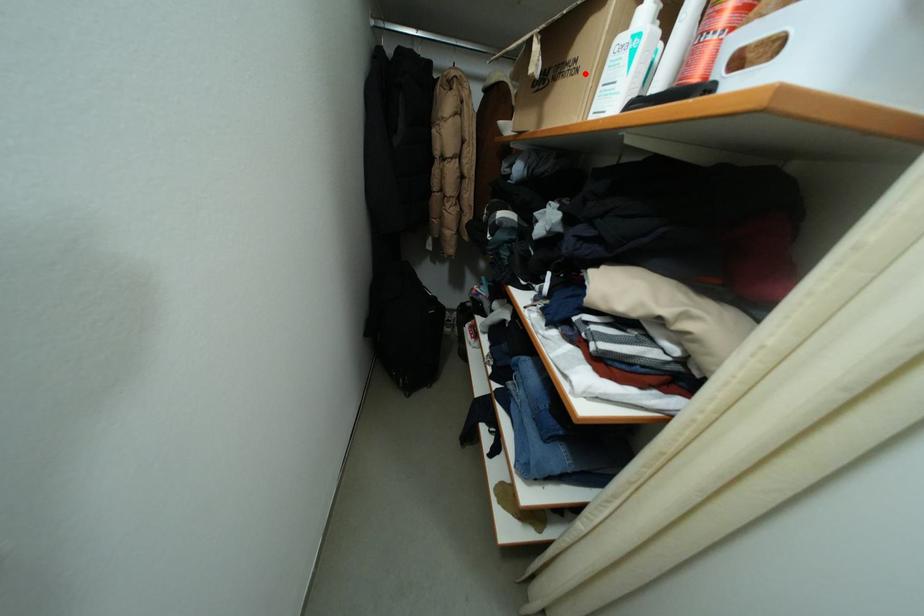
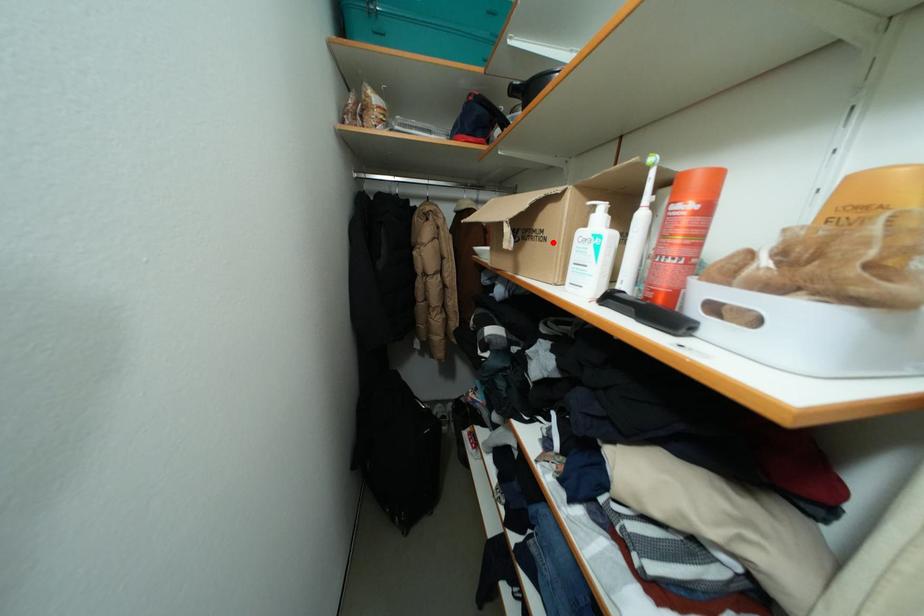
I am providing you with two images of the same scene from different viewpoints. A red point is marked on the first image and another point is marked on the second image. Is the marked point in image1 the same physical position as the marked point in image2?

Yes